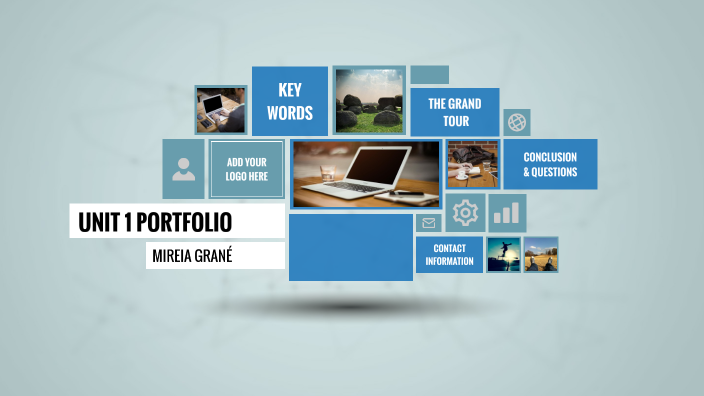
At what (x,y) coordinates should I click in order to perform the action: click on laptop. Please return your answer as a coordinate pair (x, y). Looking at the image, I should click on (377, 165).